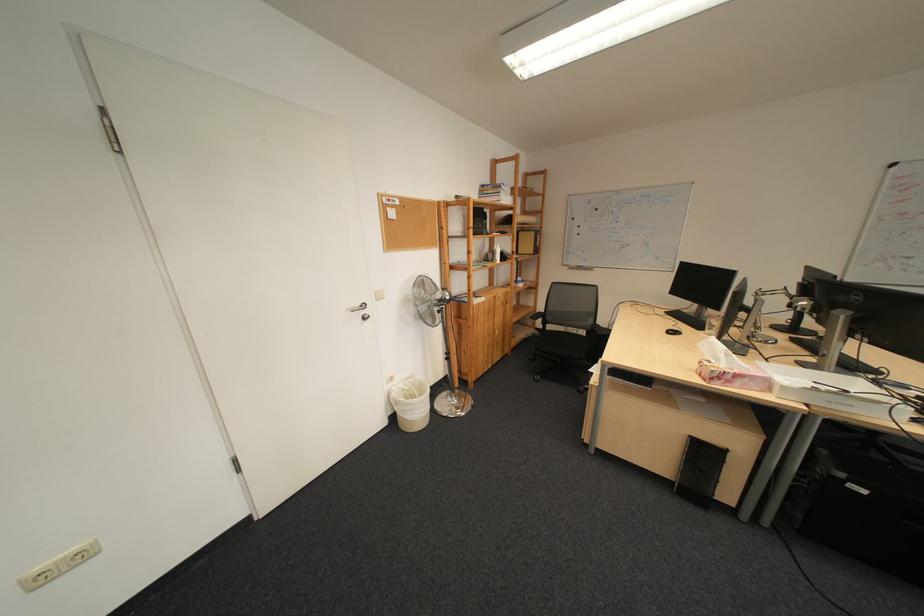
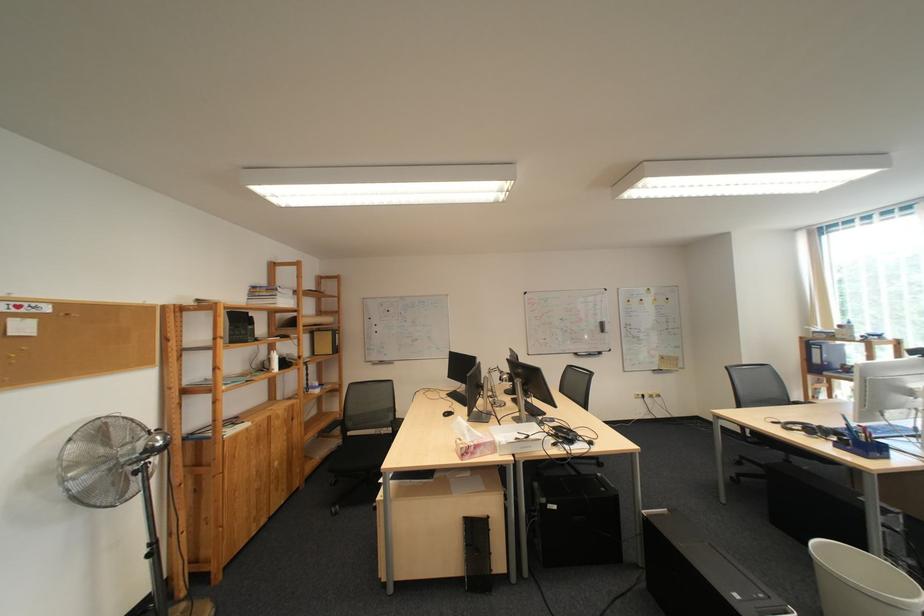
The images are taken continuously from a first-person perspective. In which direction is your viewpoint rotating?

The rotation direction of the camera is right-up.